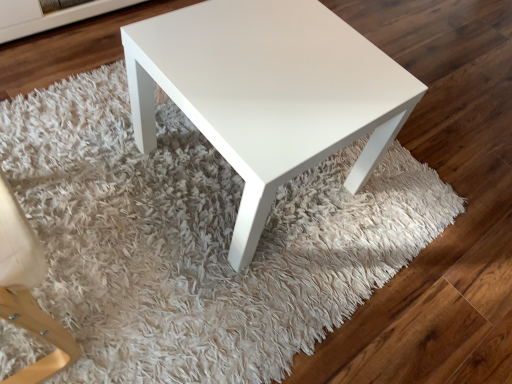
Where is `vacant space in front of white glossy table at center`? vacant space in front of white glossy table at center is located at coordinates (199, 288).